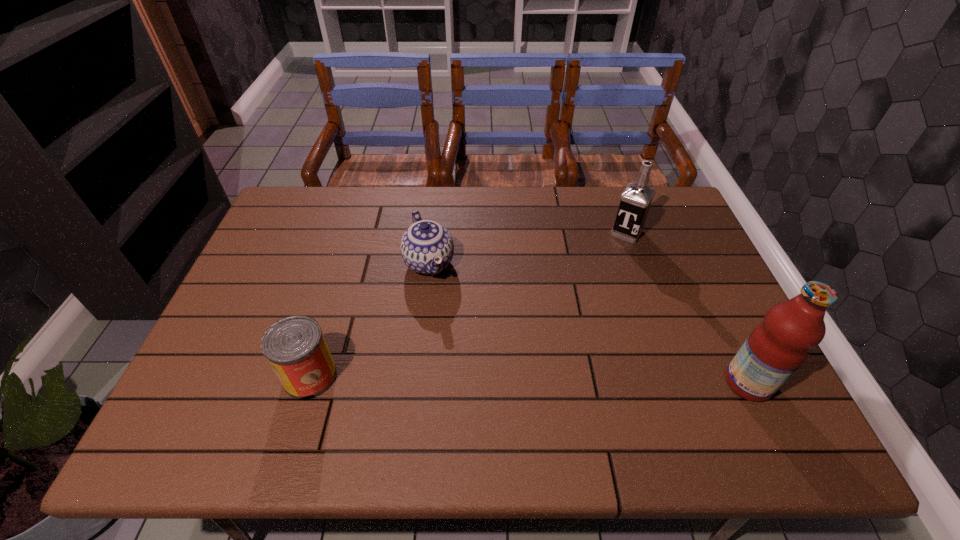
The height and width of the screenshot is (540, 960). In order to click on free space at the far edge in this screenshot , I will do `click(463, 219)`.

Where is `free space at the near edge`? free space at the near edge is located at coordinates (529, 401).

Image resolution: width=960 pixels, height=540 pixels. Identify the location of free location at the left edge of the desktop. (273, 296).

The height and width of the screenshot is (540, 960). What are the coordinates of `vacant area at the right edge of the desktop` in the screenshot? It's located at (693, 278).

Locate an element on the screen. free region at the far left corner is located at coordinates (296, 198).

This screenshot has width=960, height=540. In order to click on free space at the near left corner of the desktop in this screenshot , I will do `click(187, 396)`.

Locate an element on the screen. The height and width of the screenshot is (540, 960). vacant space in between the fruit juice and the second tallest object is located at coordinates (687, 308).

Find the location of a particular element. Image resolution: width=960 pixels, height=540 pixels. free spot between the tallest object and the leftmost object is located at coordinates (529, 380).

The image size is (960, 540). I want to click on free space between the third object from right to left and the tallest object, so click(x=588, y=323).

Locate an element on the screen. The width and height of the screenshot is (960, 540). free area in between the second tallest object and the leftmost object is located at coordinates (468, 305).